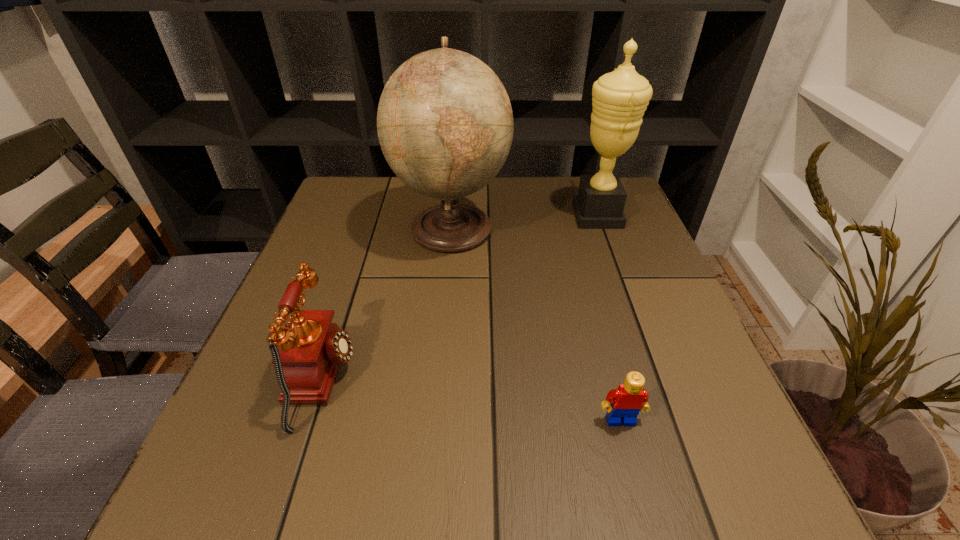
Where is `vacant area that lies between the trophy cup and the leftmost object`? The height and width of the screenshot is (540, 960). vacant area that lies between the trophy cup and the leftmost object is located at coordinates (460, 298).

The width and height of the screenshot is (960, 540). Identify the location of free space between the trophy cup and the shortest object. (609, 318).

Find the location of `object that is the second closest to the trophy cup`. object that is the second closest to the trophy cup is located at coordinates (628, 399).

The width and height of the screenshot is (960, 540). Identify the location of object identified as the closest to the globe. (619, 99).